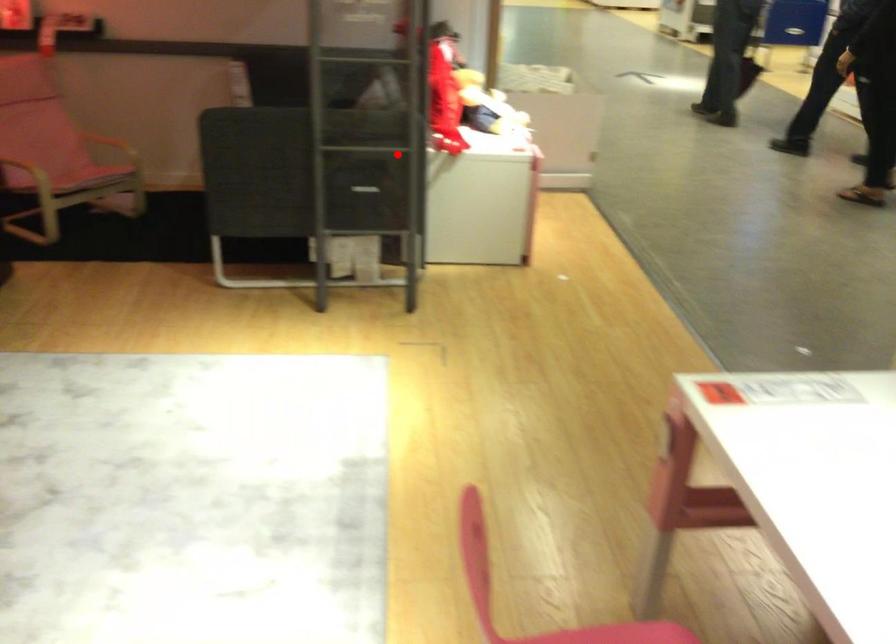
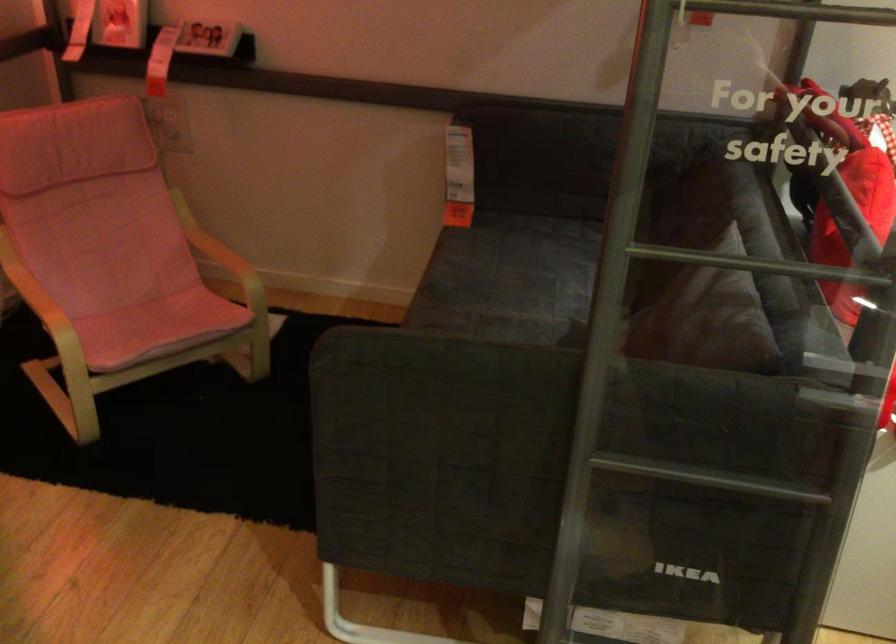
The point at the highlighted location is marked in the first image. Where is the corresponding point in the second image?

(736, 484)